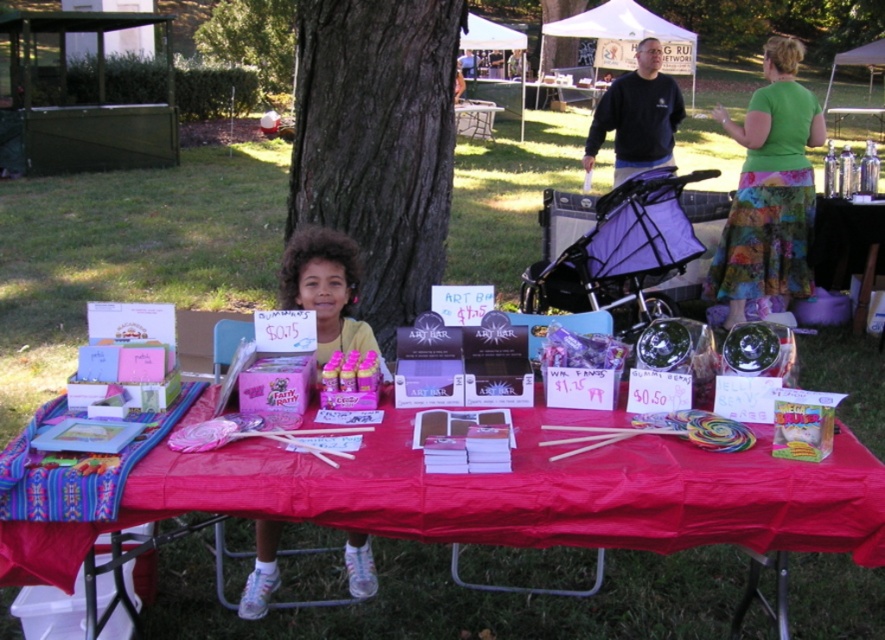
Question: Can you confirm if matte yellow shirt at center is thinner than black sweatshirt at upper right?

Choices:
 (A) yes
 (B) no

Answer: (A)

Question: Which object appears farthest from the camera in this image?

Choices:
 (A) brown rough bark tree at center
 (B) green textured skirt at upper right
 (C) green leafy tree at upper left
 (D) matte pink tablecloth at center

Answer: (C)

Question: Can you confirm if matte yellow shirt at center is thinner than black sweatshirt at upper right?

Choices:
 (A) no
 (B) yes

Answer: (B)

Question: Which of the following is the farthest from the observer?

Choices:
 (A) (685, 572)
 (B) (347, 346)
 (C) (386, 269)

Answer: (C)

Question: Which object is farther from the camera taking this photo?

Choices:
 (A) matte yellow shirt at center
 (B) matte pink tablecloth at center

Answer: (B)

Question: Does brown rough bark tree at center appear over green textured skirt at upper right?

Choices:
 (A) yes
 (B) no

Answer: (B)